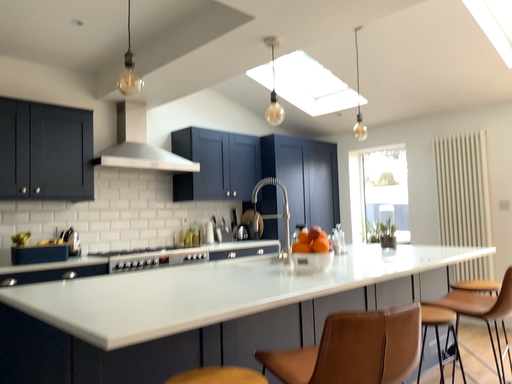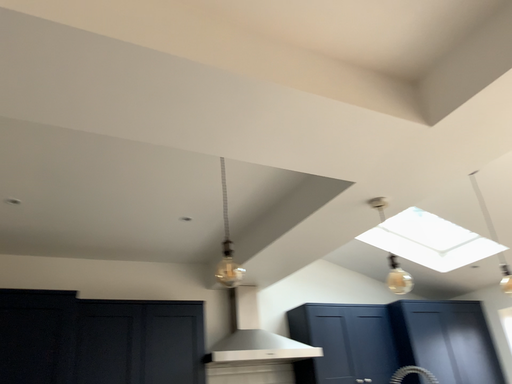
Question: Which way did the camera rotate in the video?

Choices:
 (A) rotated right
 (B) rotated left

Answer: (B)